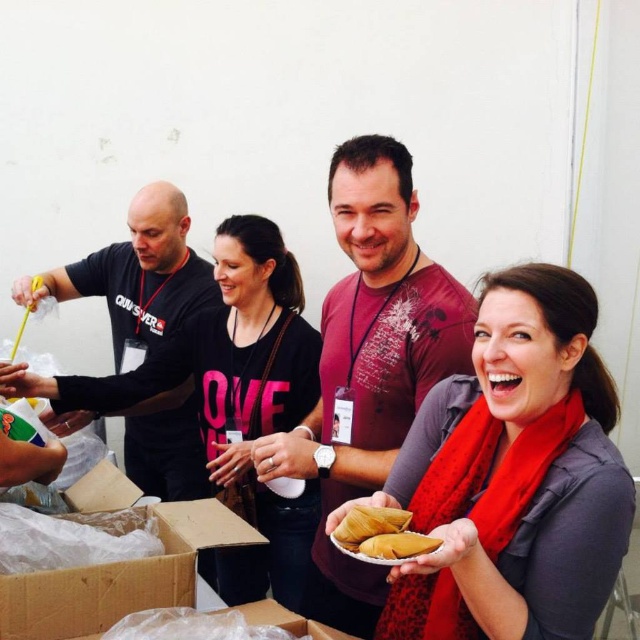
Consider the image. You are organizing a food distribution event and need to arrange items based on their positions. If you see the gray matte scarf at center and the yellow matte tamales at center, which item is positioned to the right?

The gray matte scarf at center is to the right of the yellow matte tamales at center.

You are a photographer at the event and want to take a photo of the black matte shirt at left and the gray matte scarf at center. Which object is located to the right of the other?

The gray matte scarf at center is positioned on the right side of black matte shirt at left.

Consider the image. You are a photographer at the event and need to adjust your camera settings to focus on the gray matte scarf at center and the black matte shirt at left. According to the spatial arrangement, which object is positioned lower in the frame?

The gray matte scarf at center is located below the black matte shirt at left, so it is positioned lower in the frame.